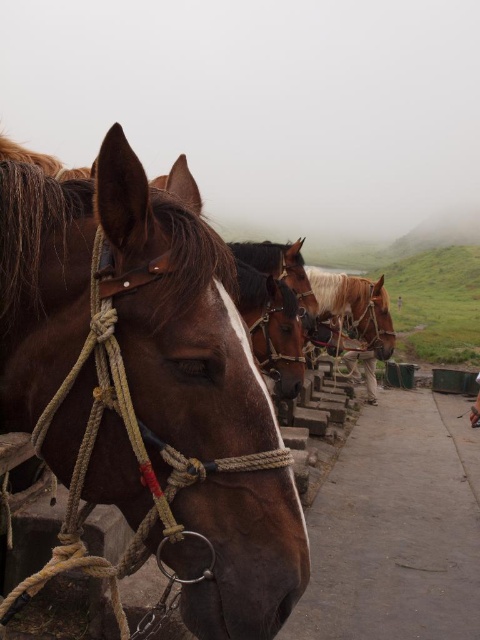
Who is more forward, [173,515] or [279,246]?

Point [173,515] is more forward.

Who is higher up, brown leather rope at left or brown leather horse at center?

brown leather horse at center is above.

Between point (146, 264) and point (297, 246), which one is positioned in front?

Point (146, 264) is in front.

Where is `brown leather rope at left`? This screenshot has width=480, height=640. brown leather rope at left is located at coordinates (148, 384).

Can you confirm if brown leather rope at left is positioned below light brown leather shoes at lower right?

Actually, brown leather rope at left is above light brown leather shoes at lower right.

Between brown leather rope at left and light brown leather shoes at lower right, which one is positioned lower?

light brown leather shoes at lower right is lower down.

Is point (275, 476) more distant than point (469, 417)?

No, it is not.

Locate an element on the screen. brown leather rope at left is located at coordinates (148, 384).

Who is positioned more to the left, brown glossy horse at center or light brown leather shoes at lower right?

brown glossy horse at center

Does brown glossy horse at center have a greater height compared to light brown leather shoes at lower right?

Correct, brown glossy horse at center is much taller as light brown leather shoes at lower right.

Locate an element on the screen. brown glossy horse at center is located at coordinates (272, 326).